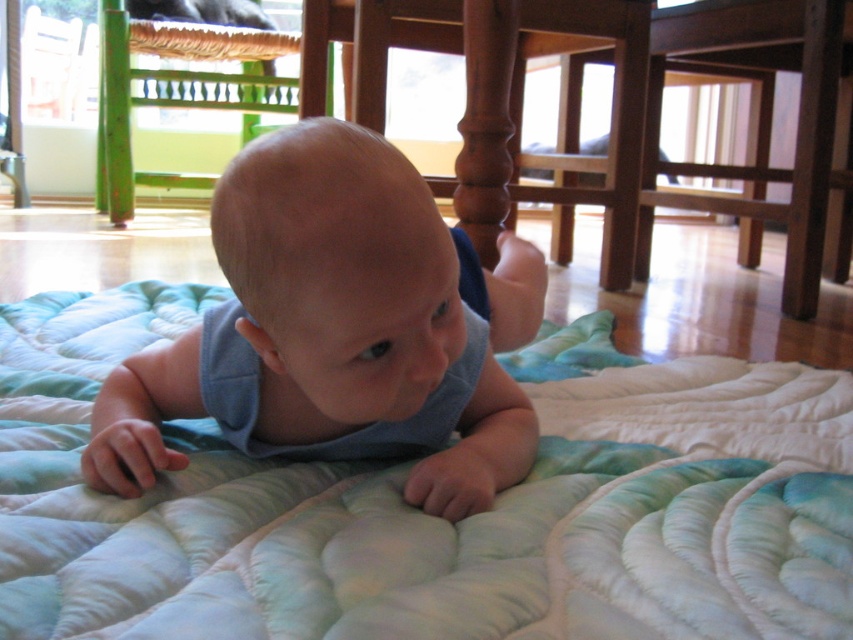
Question: In this image, where is light blue quilt at center located relative to wooden chair at center?

Choices:
 (A) above
 (B) below

Answer: (B)

Question: Among these objects, which one is farthest from the camera?

Choices:
 (A) blue fabric baby at center
 (B) green wood chair at upper left
 (C) wooden chair at center

Answer: (B)

Question: Which object appears farthest from the camera in this image?

Choices:
 (A) light blue quilt at center
 (B) green wood chair at upper left
 (C) blue fabric baby at center

Answer: (B)

Question: Can you confirm if blue fabric baby at center is positioned above wooden chair at center?

Choices:
 (A) yes
 (B) no

Answer: (B)

Question: Based on their relative distances, which object is nearer to the light blue quilt at center?

Choices:
 (A) blue fabric baby at center
 (B) wooden chair at center

Answer: (A)

Question: Is blue fabric baby at center to the left of wooden chair at center from the viewer's perspective?

Choices:
 (A) yes
 (B) no

Answer: (A)